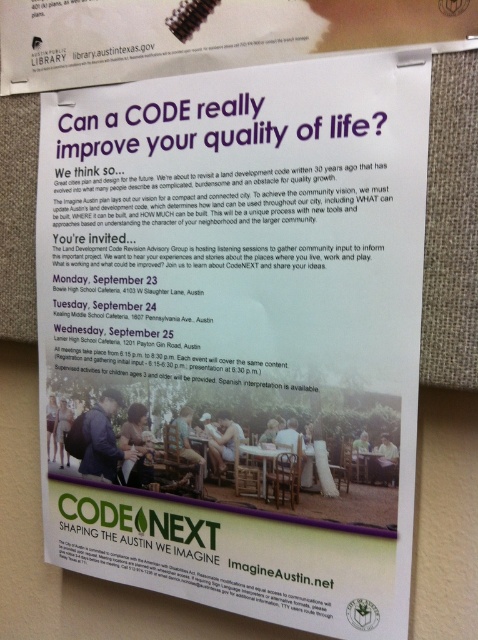
Question: Can you confirm if white paper at upper center is bigger than wooden table at lower center?

Choices:
 (A) yes
 (B) no

Answer: (A)

Question: Which object is farther from the camera taking this photo?

Choices:
 (A) white glossy table at center
 (B) white paper at upper center
 (C) wooden table at lower center

Answer: (A)

Question: Based on their relative distances, which object is nearer to the wooden table at lower center?

Choices:
 (A) white paper at upper center
 (B) white glossy table at center

Answer: (B)

Question: Can you confirm if white paper at upper center is thinner than wooden table at lower center?

Choices:
 (A) no
 (B) yes

Answer: (A)

Question: Does wooden table at lower center appear over white glossy table at center?

Choices:
 (A) no
 (B) yes

Answer: (B)

Question: Which object is farther from the camera taking this photo?

Choices:
 (A) white glossy table at center
 (B) white paper at upper center

Answer: (A)